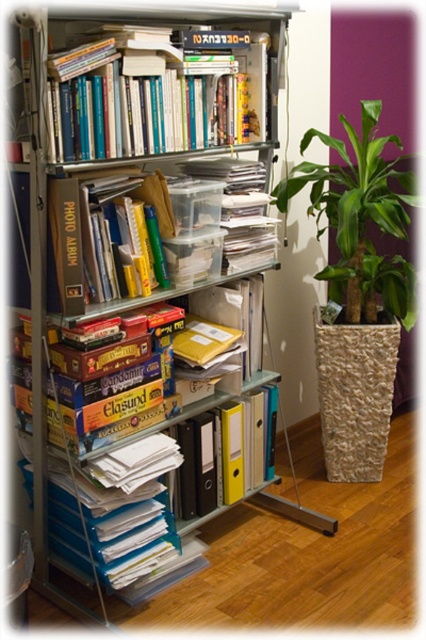
You are organizing a home office and need to place a new item on the shelf. The item requires a space that is at least 0.15 meters wide and 0.4 meters tall. Can you place it at the location of the hardcover books at upper center?

The hardcover books at upper center are located at point (155,93). Since the required width is 0.15 meters and the available width is 0.148 meters, it is insufficient. The height requirement of 0.4 meters also isn not met as the available height is 0.364 meters. Therefore, the item cannot be placed there.

You are a delivery person who just arrived at a home office. You need to place a new package that is 1.5 meters long on the floor near the metal shelving unit. Is there enough space between you and the hardcover books at upper center to maneuver the package?

The hardcover books at upper center are 1.37 meters away from the viewer. Since the package is 1.5 meters long, the distance is insufficient to maneuver the package comfortably. There might not be enough space.

You are organizing a bookshelf and need to place a new book that is 3 inches thick. You see the hardcover books at upper center and the green leafy plant at right. Which object can accommodate the thicker item?

The green leafy plant at right is thicker than the hardcover books at upper center, so it can accommodate the thicker item.